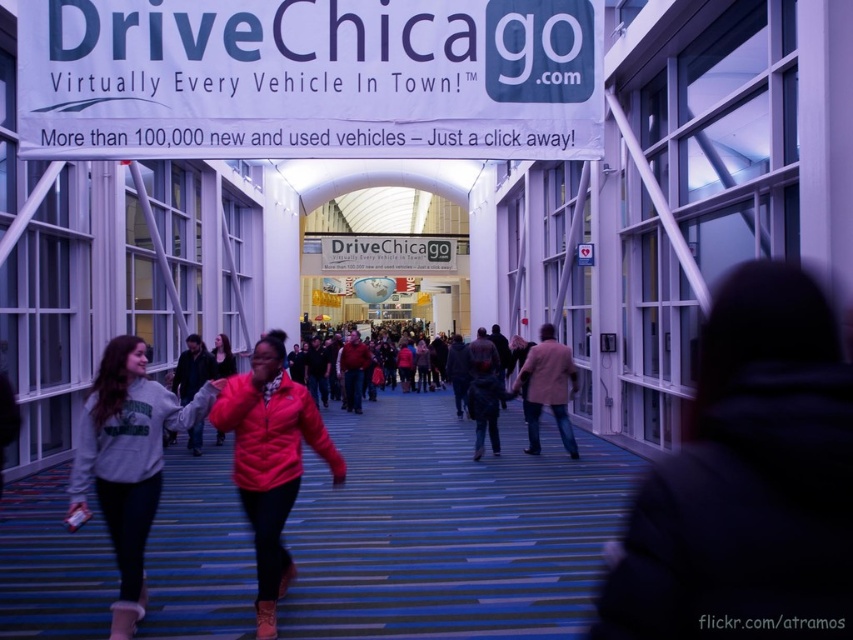
Is gray fleece sweatshirt at center positioned behind beige woolen jacket at center?

No, gray fleece sweatshirt at center is closer to the viewer.

Locate an element on the screen. The width and height of the screenshot is (853, 640). gray fleece sweatshirt at center is located at coordinates (126, 461).

I want to click on gray fleece sweatshirt at center, so click(x=126, y=461).

Is gray fleece sweatshirt at center closer to the viewer compared to white plastic sign at center?

That is True.

Is point (105, 410) less distant than point (325, 241)?

Yes, point (105, 410) is in front of point (325, 241).

Where is `gray fleece sweatshirt at center`? gray fleece sweatshirt at center is located at coordinates (126, 461).

Can you confirm if matte red jacket at center is wider than beige woolen jacket at center?

Indeed, matte red jacket at center has a greater width compared to beige woolen jacket at center.

Does matte red jacket at center have a smaller size compared to beige woolen jacket at center?

No.

What are the coordinates of `matte red jacket at center` in the screenshot? It's located at (271, 429).